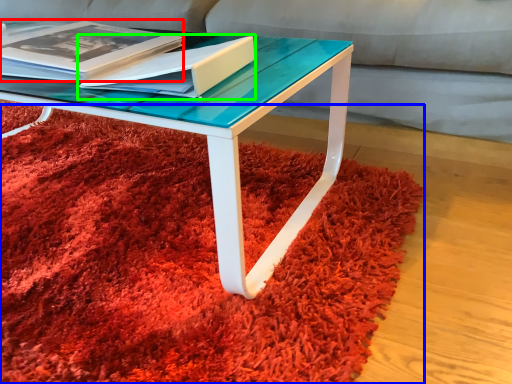
Question: Estimate the real-world distances between objects in this image. Which object is farther from magazine (highlighted by a red box), mat (highlighted by a blue box) or paperback book (highlighted by a green box)?

Choices:
 (A) mat
 (B) paperback book

Answer: (A)